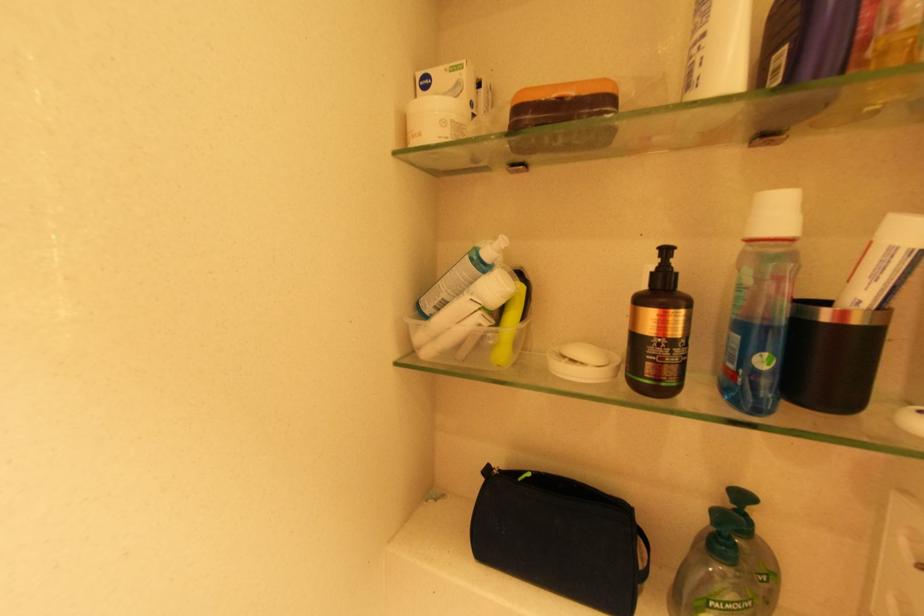
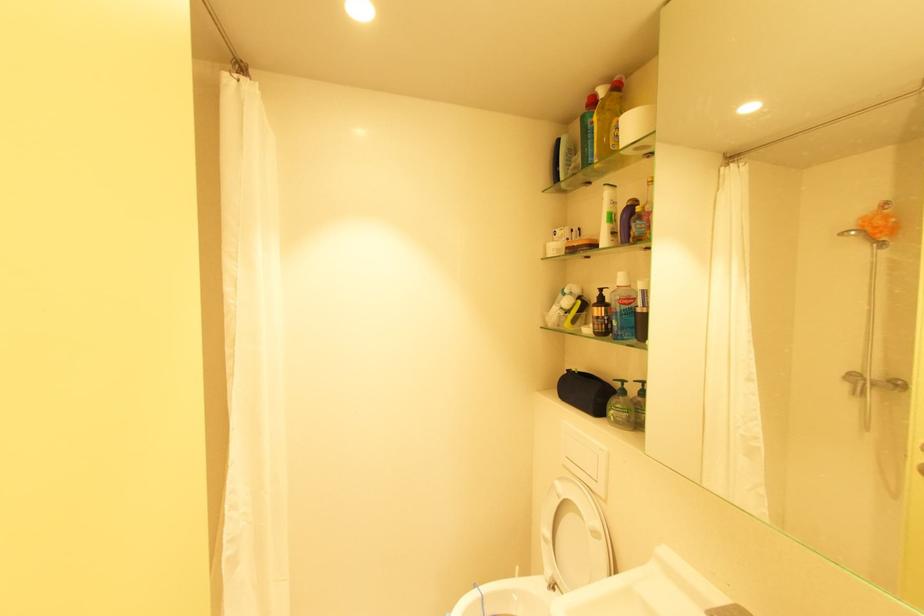
The point at (x=488, y=480) is marked in the first image. Where is the corresponding point in the second image?

(570, 373)